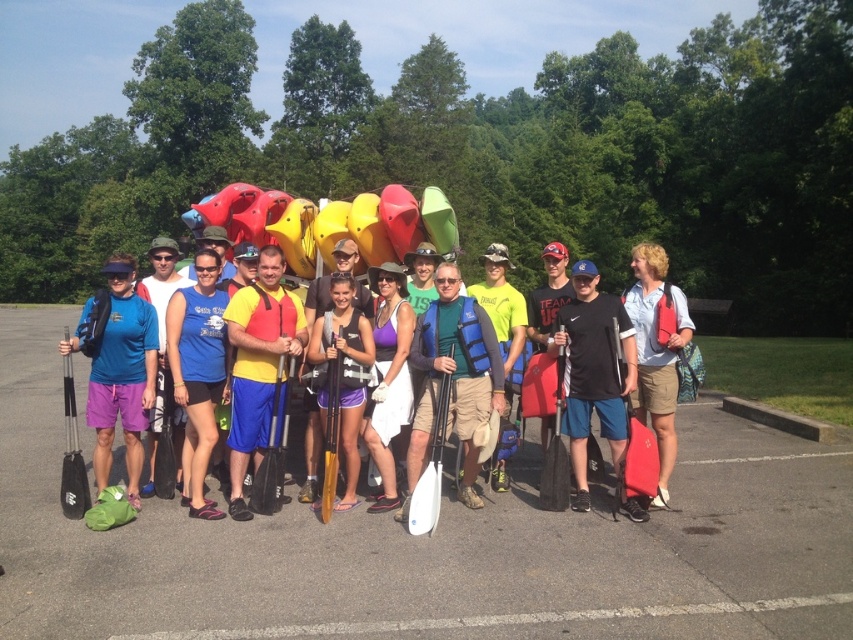
Between matte blue shirt at center and light blue shirt at center, which one is positioned lower?

matte blue shirt at center

Is point (125, 285) positioned behind point (660, 508)?

No, (125, 285) is closer to viewer.

Where is `matte blue shirt at center`? This screenshot has height=640, width=853. matte blue shirt at center is located at coordinates (119, 369).

Who is more forward, (573, 348) or (628, 337)?

Point (628, 337)

Is black matte shirt at center smaller than yellow life vest at center?

Incorrect, black matte shirt at center is not smaller in size than yellow life vest at center.

Between point (616, 410) and point (613, 456), which one is positioned in front?

Point (616, 410) is more forward.

Locate an element on the screen. The height and width of the screenshot is (640, 853). black matte shirt at center is located at coordinates (593, 371).

Between point (90, 624) and point (583, 285), which one is positioned behind?

The point (583, 285) is behind.

Is black rubber paddle at center closer to camera compared to black matte shirt at center?

Yes, it is.

The image size is (853, 640). Identify the location of black rubber paddle at center. (428, 545).

The height and width of the screenshot is (640, 853). Identify the location of black rubber paddle at center. (428, 545).